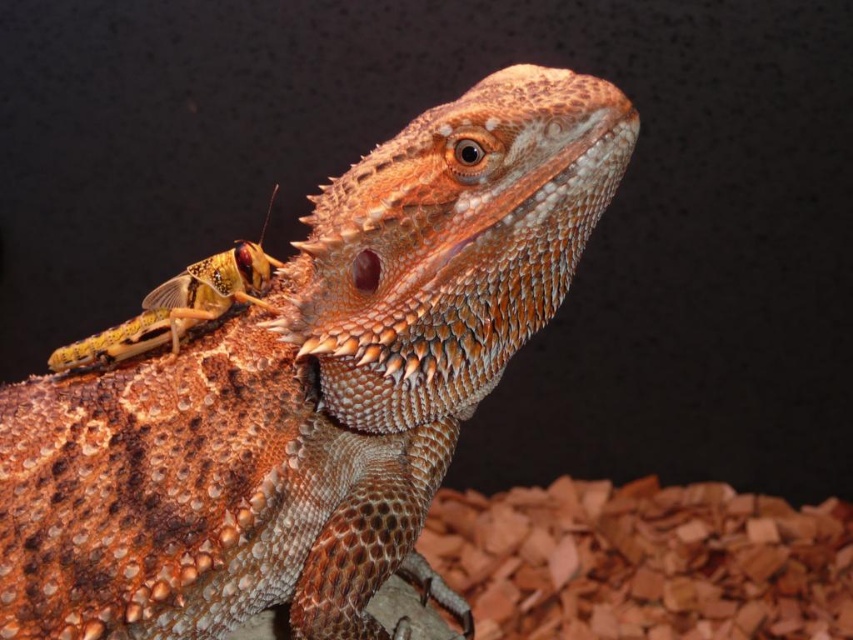
Is shiny orange scales at upper center wider than golden textured grasshopper at upper left?

Correct, the width of shiny orange scales at upper center exceeds that of golden textured grasshopper at upper left.

Between shiny orange scales at upper center and golden textured grasshopper at upper left, which one appears on the right side from the viewer's perspective?

shiny orange scales at upper center

Between point (323, 262) and point (194, 323), which one is positioned in front?

Point (323, 262) is in front.

Locate an element on the screen. shiny orange scales at upper center is located at coordinates (311, 388).